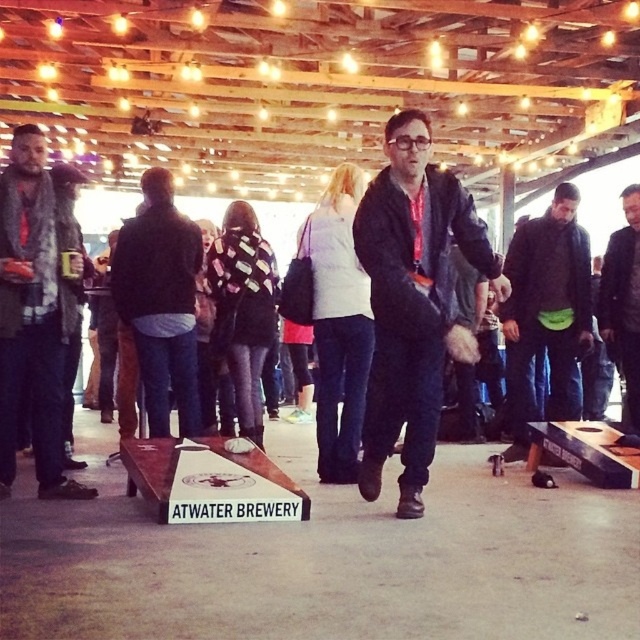
Question: Estimate the real-world distances between objects in this image. Which object is farther from the black leather jacket at center?

Choices:
 (A) black fuzzy jacket at center
 (B) green fabric pouch at center

Answer: (A)

Question: Is green fabric pouch at center smaller than black leather jacket at center?

Choices:
 (A) yes
 (B) no

Answer: (B)

Question: Can you confirm if gray wool scarf at left is bigger than black matte jacket at center?

Choices:
 (A) no
 (B) yes

Answer: (B)

Question: Which object is closer to the camera taking this photo?

Choices:
 (A) gray wool scarf at left
 (B) black fuzzy jacket at center
 (C) black leather jacket at center

Answer: (B)

Question: Can you confirm if black matte jacket at center is bigger than green fabric pouch at center?

Choices:
 (A) no
 (B) yes

Answer: (A)

Question: Which point is closer to the camera?

Choices:
 (A) black leather jacket at center
 (B) gray wool scarf at left
 (C) black fuzzy jacket at center
 (D) green fabric pouch at center

Answer: (C)